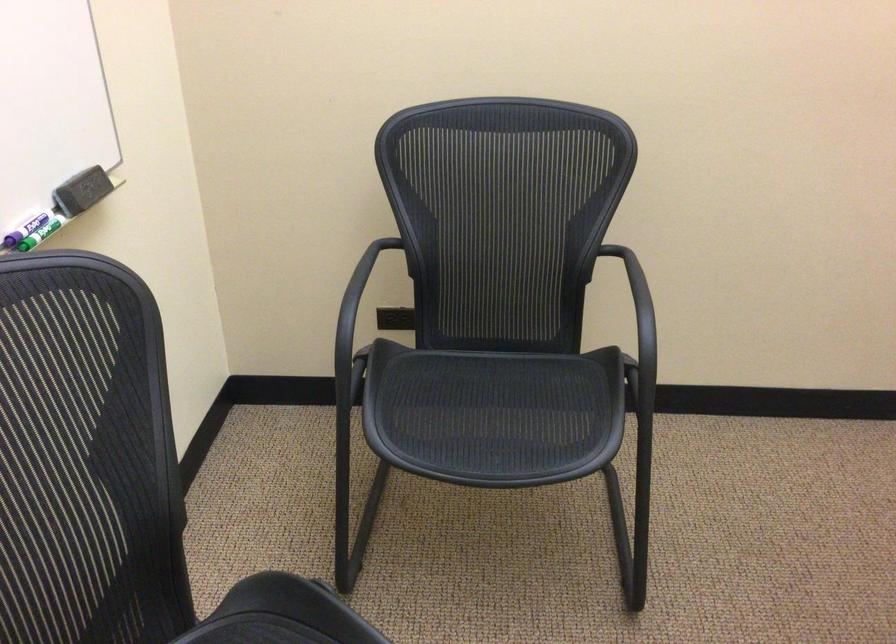
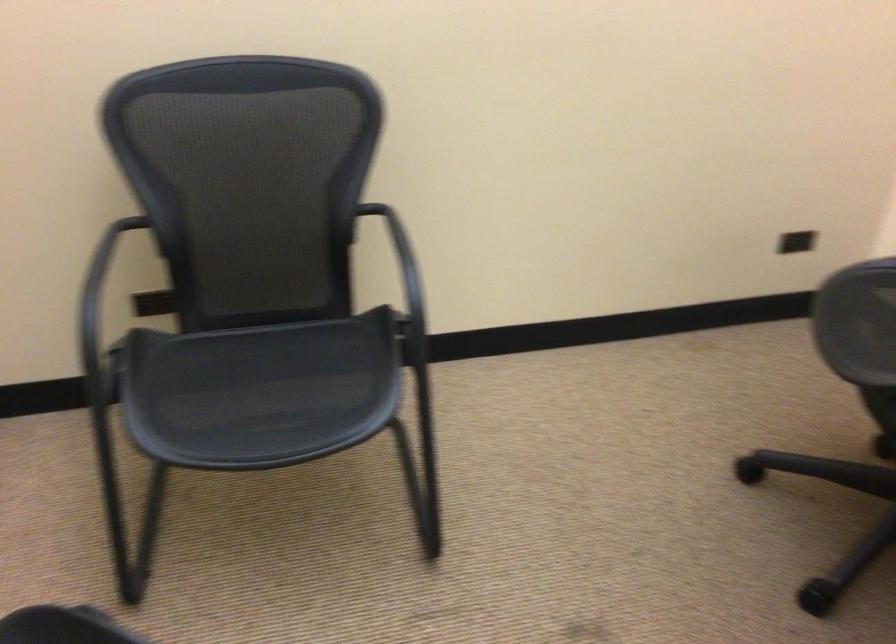
Question: How did the camera likely rotate?

Choices:
 (A) Left
 (B) Right
 (C) Up
 (D) Down

Answer: (B)